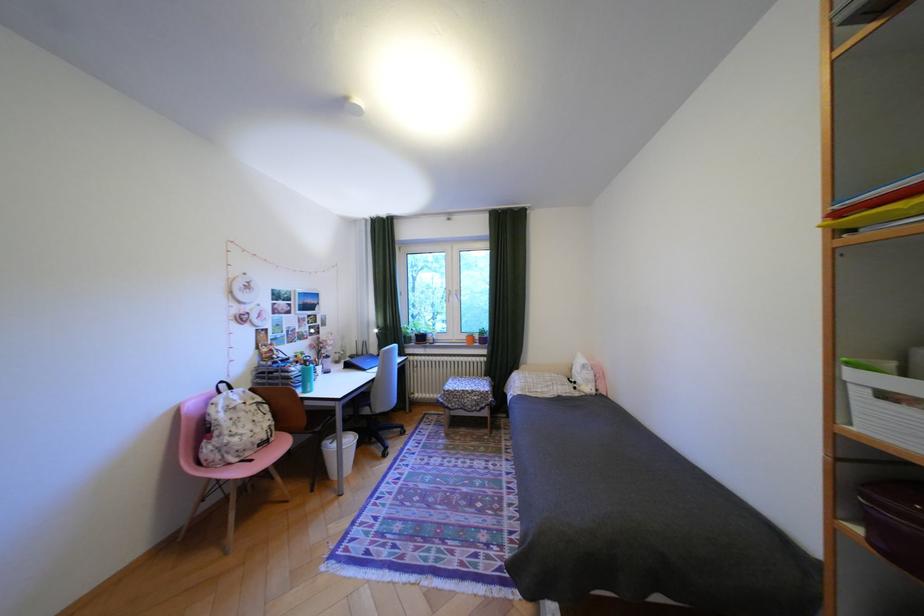
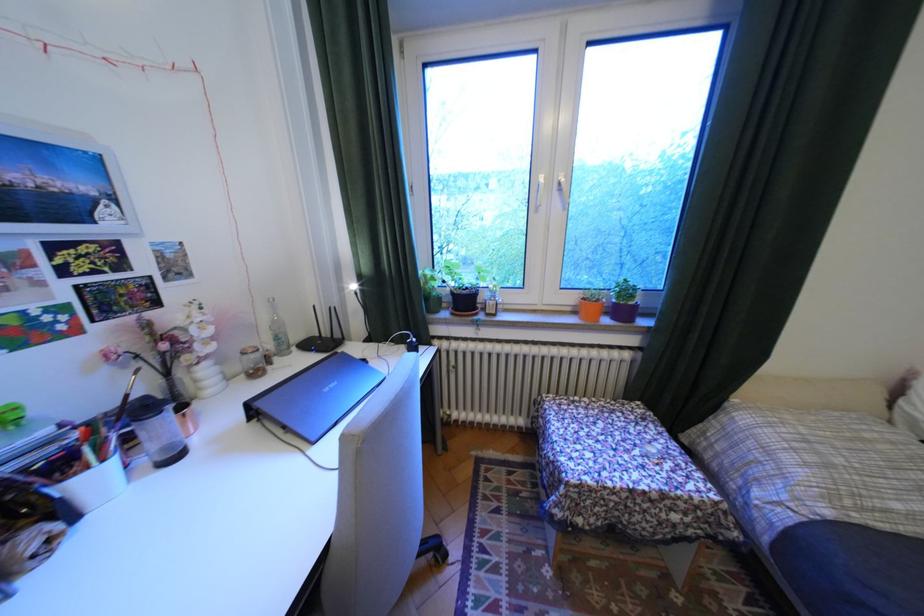
In the second image, find the point that corresponds to the point at 421,338 in the first image.

(451, 299)